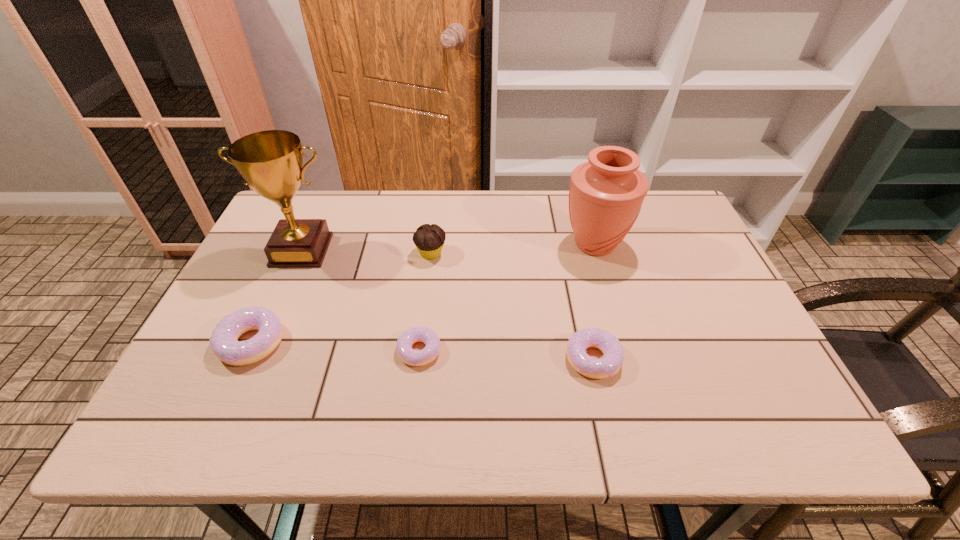
Please point a spot to add another doughnut on the right. Please provide its 2D coordinates. Your answer should be formatted as a tuple, i.e. [(x, y)], where the tuple contains the x and y coordinates of a point satisfying the conditions above.

[(772, 367)]